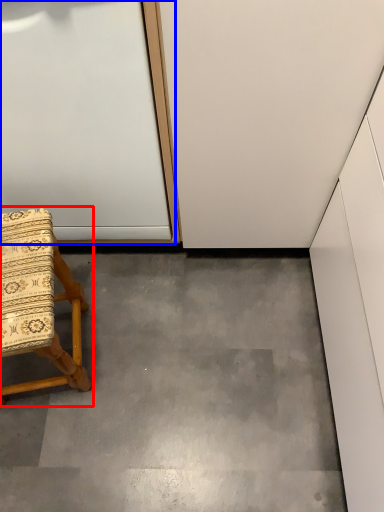
Question: Which point is closer to the camera, chair (highlighted by a red box) or door (highlighted by a blue box)?

Choices:
 (A) chair
 (B) door

Answer: (B)